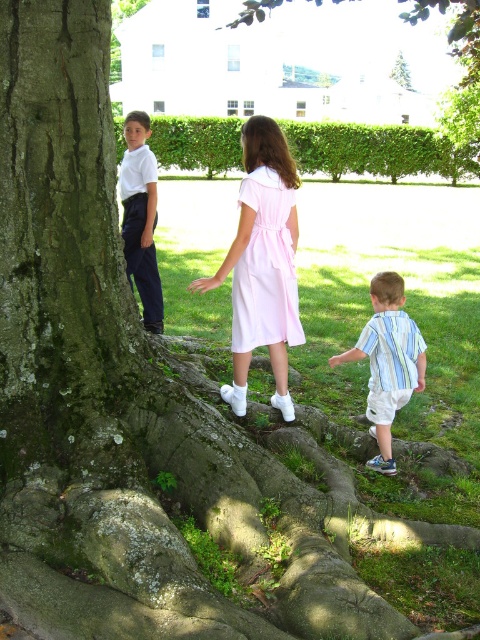
Question: Which object is positioned farthest from the striped cotton shirt at lower right?

Choices:
 (A) green mossy tree trunk at upper center
 (B) pink cotton dress at center
 (C) pink satin dress at center
 (D) matte white shirt at left

Answer: (A)

Question: Can you confirm if pink satin dress at center is positioned to the right of matte white shirt at left?

Choices:
 (A) no
 (B) yes

Answer: (B)

Question: Which point is closer to the camera taking this photo?

Choices:
 (A) (340, 1)
 (B) (257, 196)
 (C) (264, 182)
 (D) (409, 333)

Answer: (C)

Question: Among these objects, which one is nearest to the camera?

Choices:
 (A) pink cotton dress at center
 (B) striped cotton shirt at lower right
 (C) pink satin dress at center
 (D) matte white shirt at left

Answer: (D)

Question: Is pink cotton dress at center further to camera compared to matte white shirt at left?

Choices:
 (A) yes
 (B) no

Answer: (A)

Question: Can you confirm if striped cotton shirt at lower right is smaller than green mossy tree trunk at upper center?

Choices:
 (A) no
 (B) yes

Answer: (B)